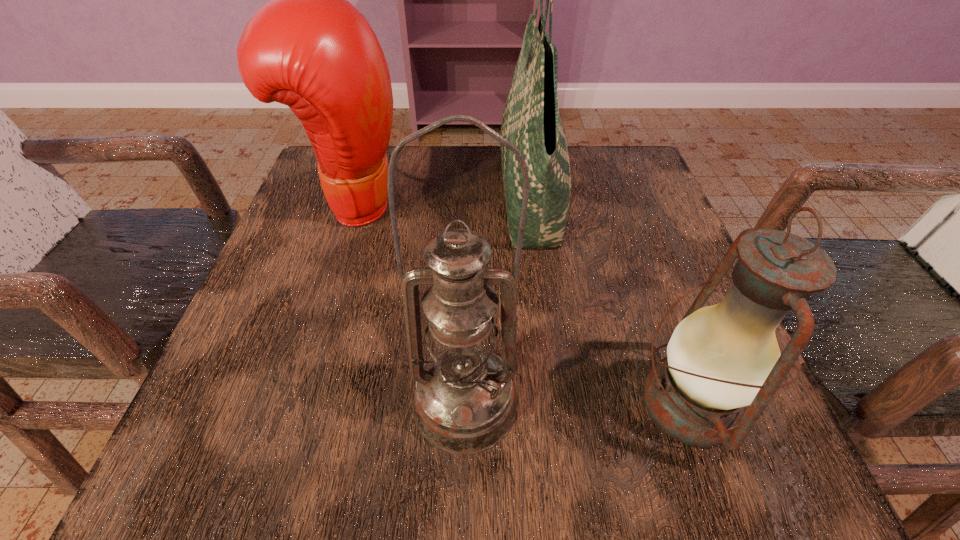
Image resolution: width=960 pixels, height=540 pixels. What are the coordinates of `free point that satisfies the following two spatial constraints: 1. on the striking surface of the leftmost object; 2. on the left side of the shortest object` in the screenshot? It's located at (288, 403).

Identify the location of vacant space that satisfies the following two spatial constraints: 1. on the back side of the tote bag; 2. on the right side of the taller oil lamp. (470, 198).

The height and width of the screenshot is (540, 960). What are the coordinates of `free spot that satisfies the following two spatial constraints: 1. on the striking surface of the leftmost object; 2. on the left side of the shorter oil lamp` in the screenshot? It's located at (288, 403).

At what (x,y) coordinates should I click in order to perform the action: click on free location that satisfies the following two spatial constraints: 1. on the striking surface of the leftmost object; 2. on the back side of the shorter oil lamp. Please return your answer as a coordinate pair (x, y). Looking at the image, I should click on (288, 403).

Image resolution: width=960 pixels, height=540 pixels. Identify the location of vacant position in the image that satisfies the following two spatial constraints: 1. on the striking surface of the left oil lamp; 2. on the right side of the leftmost object. (288, 402).